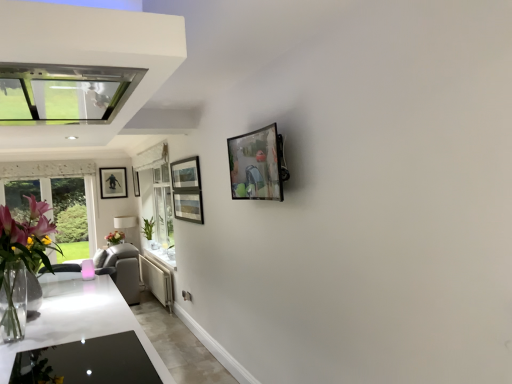
I want to click on matte white lampshade at center, so click(x=126, y=226).

Measure the distance between white glossy exhaust hood at upper left and camera.

2.51 meters.

Image resolution: width=512 pixels, height=384 pixels. I want to click on white glossy countertop at lower left, so click(x=83, y=330).

What do you see at coordinates (113, 182) in the screenshot? I see `matte black picture frame at left, which is the first picture frame in left-to-right order` at bounding box center [113, 182].

Where is `matte black picture frame at center, the 2th picture frame from the back`? This screenshot has height=384, width=512. matte black picture frame at center, the 2th picture frame from the back is located at coordinates (136, 182).

This screenshot has height=384, width=512. What do you see at coordinates (22, 257) in the screenshot?
I see `clear glass vase at left` at bounding box center [22, 257].

The height and width of the screenshot is (384, 512). I want to click on clear glass vase at left, so click(x=22, y=257).

Image resolution: width=512 pixels, height=384 pixels. What do you see at coordinates (257, 165) in the screenshot? I see `metallic glass picture frame at upper center, arranged as the 1th picture frame when viewed from the right` at bounding box center [257, 165].

Identify the location of green leafy plant at lower left. This screenshot has width=512, height=384. (148, 228).

Is matte black picture frame at left, which is counted as the 3th picture frame, starting from the front, completely or partially inside matte white lampshade at center?

No, matte black picture frame at left, which is counted as the 3th picture frame, starting from the front, is not inside matte white lampshade at center.

In the image, is matte white lampshade at center positioned in front of or behind matte black picture frame at left, which is the first picture frame in left-to-right order?

Clearly, matte white lampshade at center is in front of matte black picture frame at left, which is the first picture frame in left-to-right order.

From a real-world perspective, is matte white lampshade at center above or below matte black picture frame at left, which is the first picture frame in left-to-right order?

Clearly, from a real-world perspective, matte white lampshade at center is below matte black picture frame at left, which is the first picture frame in left-to-right order.

Which is behind, point (100, 176) or point (30, 261)?

Positioned behind is point (100, 176).

Which of these two, matte black picture frame at left, the first picture frame in the back-to-front sequence, or clear glass vase at left, is thinner?

matte black picture frame at left, the first picture frame in the back-to-front sequence, is thinner.

From a real-world perspective, relative to clear glass vase at left, is matte black picture frame at left, the 3th picture frame from the right, vertically above or below?

matte black picture frame at left, the 3th picture frame from the right, is situated higher than clear glass vase at left in the real world.

Is matte black picture frame at left, which is the first picture frame in left-to-right order, taller or shorter than clear glass vase at left?

Considering their sizes, matte black picture frame at left, which is the first picture frame in left-to-right order, has less height than clear glass vase at left.

Which is farther, (240, 147) or (106, 125)?

Point (240, 147)

From the picture: From a real-world perspective, does metallic glass picture frame at upper center, which is the 3th picture frame in back-to-front order, stand above white glossy exhaust hood at upper left?

No, from a real-world perspective, metallic glass picture frame at upper center, which is the 3th picture frame in back-to-front order, is not on top of white glossy exhaust hood at upper left.

Identify the location of exhaust hood above the metallic glass picture frame at upper center, which is the first picture frame from front to back (from the image's perspective). This screenshot has height=384, width=512. (88, 57).

Is metallic glass picture frame at upper center, arranged as the 1th picture frame when viewed from the right, at the right side of white glossy exhaust hood at upper left?

Indeed, metallic glass picture frame at upper center, arranged as the 1th picture frame when viewed from the right, is positioned on the right side of white glossy exhaust hood at upper left.

Is the surface of white glossy countertop at lower left in direct contact with white glossy exhaust hood at upper left?

There is a gap between white glossy countertop at lower left and white glossy exhaust hood at upper left.

Is white glossy countertop at lower left in front of or behind white glossy exhaust hood at upper left in the image?

white glossy countertop at lower left is behind white glossy exhaust hood at upper left.

Considering the sizes of objects white glossy countertop at lower left and white glossy exhaust hood at upper left in the image provided, who is wider, white glossy countertop at lower left or white glossy exhaust hood at upper left?

white glossy countertop at lower left.

Is white glossy exhaust hood at upper left at the back of white glossy countertop at lower left?

No, white glossy countertop at lower left's orientation is not away from white glossy exhaust hood at upper left.

Is metallic glass picture frame at upper center, arranged as the 1th picture frame when viewed from the right, facing towards white glossy countertop at lower left?

No, metallic glass picture frame at upper center, arranged as the 1th picture frame when viewed from the right, is not facing towards white glossy countertop at lower left.

From a real-world perspective, is metallic glass picture frame at upper center, arranged as the 1th picture frame when viewed from the right, below white glossy countertop at lower left?

No.

What are the coordinates of `picture frame on the right of white glossy countertop at lower left` in the screenshot? It's located at (257, 165).

Is green leafy plant at lower left taller than matte black picture frame at center, the second picture frame viewed from the left?

Yes, green leafy plant at lower left is taller than matte black picture frame at center, the second picture frame viewed from the left.

From a real-world perspective, does green leafy plant at lower left stand above matte black picture frame at center, which is counted as the second picture frame, starting from the front?

Incorrect, from a real-world perspective, green leafy plant at lower left is lower than matte black picture frame at center, which is counted as the second picture frame, starting from the front.

Considering the sizes of green leafy plant at lower left and matte black picture frame at center, the second picture frame viewed from the left, in the image, is green leafy plant at lower left wider or thinner than matte black picture frame at center, the second picture frame viewed from the left,?

Considering their sizes, green leafy plant at lower left looks broader than matte black picture frame at center, the second picture frame viewed from the left.

Locate an element on the screen. The image size is (512, 384). plant lying on the right of matte black picture frame at center, acting as the 2th picture frame starting from the right is located at coordinates (148, 228).

Is green leafy plant at lower left positioned far away from clear glass vase at left?

Indeed, green leafy plant at lower left is not near clear glass vase at left.

From the picture: Is green leafy plant at lower left in front of or behind clear glass vase at left in the image?

Visually, green leafy plant at lower left is located behind clear glass vase at left.

From the image's perspective, between green leafy plant at lower left and clear glass vase at left, who is located below?

green leafy plant at lower left appears lower in the image.

Considering the sizes of green leafy plant at lower left and clear glass vase at left in the image, is green leafy plant at lower left bigger or smaller than clear glass vase at left?

In the image, green leafy plant at lower left appears to be smaller than clear glass vase at left.

Identify the location of the 1st picture frame positioned above the matte white lampshade at center (from the image's perspective). The width and height of the screenshot is (512, 384). pyautogui.click(x=113, y=182).

Which picture frame is the 2nd one when counting from the left side of the clear glass vase at left? Please provide its 2D coordinates.

[(113, 182)]

Considering their positions, is white glossy exhaust hood at upper left positioned further to green leafy plant at lower left than metallic glass picture frame at upper center, the third picture frame in the left-to-right sequence?

metallic glass picture frame at upper center, the third picture frame in the left-to-right sequence, is further to green leafy plant at lower left.

From the image, which object appears to be farther from green leafy plant at lower left, white glossy countertop at lower left or clear glass vase at left?

The object further to green leafy plant at lower left is clear glass vase at left.

When comparing their distances from green leafy plant at lower left, does white glossy exhaust hood at upper left or matte black picture frame at left, the 3th picture frame from the right, seem closer?

Based on the image, matte black picture frame at left, the 3th picture frame from the right, appears to be nearer to green leafy plant at lower left.

Estimate the real-world distances between objects in this image. Which object is further from white glossy exhaust hood at upper left, matte black picture frame at center, the second picture frame viewed from the left, or matte black picture frame at left, which is the first picture frame in left-to-right order?

matte black picture frame at center, the second picture frame viewed from the left.

Based on their spatial positions, is matte white lampshade at center or matte black picture frame at center, acting as the 2th picture frame starting from the right, further from metallic glass picture frame at upper center, which is the 3th picture frame in back-to-front order?

matte white lampshade at center is further to metallic glass picture frame at upper center, which is the 3th picture frame in back-to-front order.

From the picture: When comparing their distances from white glossy countertop at lower left, does matte black picture frame at left, the first picture frame in the back-to-front sequence, or clear glass vase at left seem further?

The object further to white glossy countertop at lower left is matte black picture frame at left, the first picture frame in the back-to-front sequence.

Looking at the image, which one is located further to matte black picture frame at center, the 2th picture frame from the back, white glossy exhaust hood at upper left or white glossy countertop at lower left?

Among the two, white glossy countertop at lower left is located further to matte black picture frame at center, the 2th picture frame from the back.

Based on their spatial positions, is matte black picture frame at left, the 3th picture frame from the right, or white glossy countertop at lower left closer to metallic glass picture frame at upper center, which is the first picture frame from front to back?

white glossy countertop at lower left is closer to metallic glass picture frame at upper center, which is the first picture frame from front to back.

This screenshot has width=512, height=384. In order to click on plant between metallic glass picture frame at upper center, which is the first picture frame from front to back, and matte black picture frame at center, which is counted as the second picture frame, starting from the front, in the front-back direction in this screenshot , I will do `click(148, 228)`.

The width and height of the screenshot is (512, 384). What are the coordinates of `floral arrangement located between white glossy exhaust hood at upper left and metallic glass picture frame at upper center, which is the 3th picture frame in back-to-front order, in the depth direction` in the screenshot? It's located at (22, 257).

Image resolution: width=512 pixels, height=384 pixels. I want to click on picture frame located between white glossy countertop at lower left and matte white lampshade at center in the depth direction, so click(136, 182).

I want to click on picture frame positioned between clear glass vase at left and green leafy plant at lower left from near to far, so click(x=257, y=165).